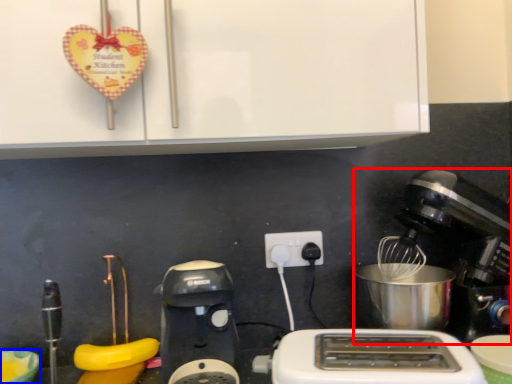
Question: Which point is closer to the camera, mixer (highlighted by a red box) or bowl (highlighted by a blue box)?

Choices:
 (A) mixer
 (B) bowl

Answer: (B)